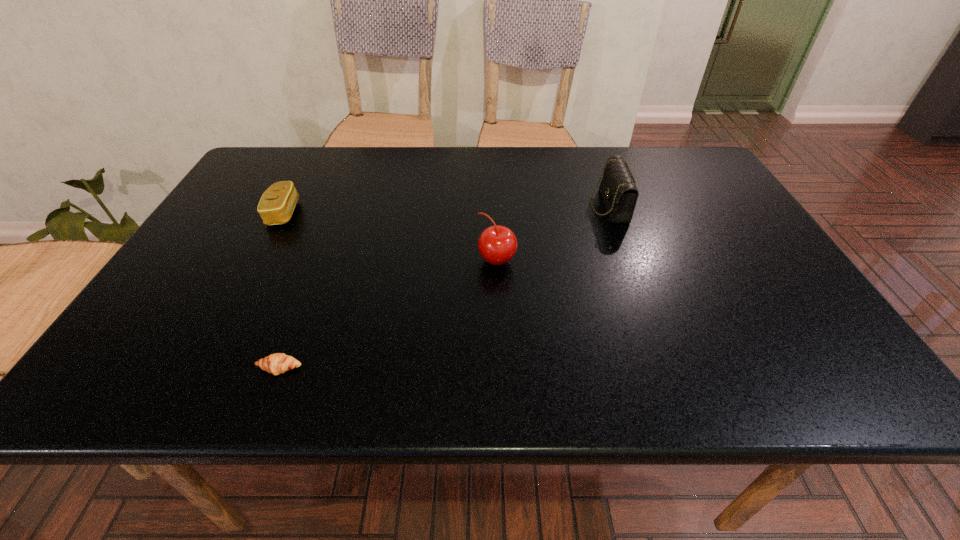
Point out which object is positioned as the second nearest to the rightmost object. Please provide its 2D coordinates. Your answer should be formatted as a tuple, i.e. [(x, y)], where the tuple contains the x and y coordinates of a point satisfying the conditions above.

[(278, 363)]

Identify which object is the nearest to the second nearest object. Please provide its 2D coordinates. Your answer should be formatted as a tuple, i.e. [(x, y)], where the tuple contains the x and y coordinates of a point satisfying the conditions above.

[(618, 190)]

You are a GUI agent. You are given a task and a screenshot of the screen. Output one action in this format:
    pyautogui.click(x=<x>, y=<y>)
    Task: Click on the blank area in the image that satisfies the following two spatial constraints: 1. on the front flap of the taller clutch bag; 2. on the front-facing side of the shortest object
    This screenshot has height=540, width=960.
    Given the screenshot: What is the action you would take?
    pyautogui.click(x=669, y=368)

Locate an element on the screen. vacant space that satisfies the following two spatial constraints: 1. on the zipper side of the second shortest object; 2. on the right side of the cherry is located at coordinates (258, 260).

At what (x,y) coordinates should I click in order to perform the action: click on free space that satisfies the following two spatial constraints: 1. on the front flap of the rightmost object; 2. on the front-facing side of the second object from left to right. Please return your answer as a coordinate pair (x, y). Image resolution: width=960 pixels, height=540 pixels. Looking at the image, I should click on (669, 368).

Find the location of a particular element. This screenshot has height=540, width=960. free spot that satisfies the following two spatial constraints: 1. on the front flap of the rightmost object; 2. on the front-facing side of the shortest object is located at coordinates (669, 368).

You are a GUI agent. You are given a task and a screenshot of the screen. Output one action in this format:
    pyautogui.click(x=<x>, y=<y>)
    Task: Click on the vacant space that satisfies the following two spatial constraints: 1. on the front flap of the taller clutch bag; 2. on the front-facing side of the shortest object
    The image size is (960, 540).
    Given the screenshot: What is the action you would take?
    [x=669, y=368]

At what (x,y) coordinates should I click in order to perform the action: click on vacant space that satisfies the following two spatial constraints: 1. on the zipper side of the leftmost object; 2. on the left side of the cherry. Please return your answer as a coordinate pair (x, y). The width and height of the screenshot is (960, 540). Looking at the image, I should click on (258, 260).